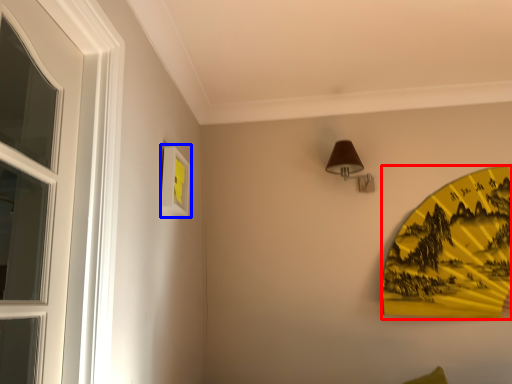
Question: Which of the following is the farthest to the observer, design (highlighted by a red box) or picture frame (highlighted by a blue box)?

Choices:
 (A) design
 (B) picture frame

Answer: (A)